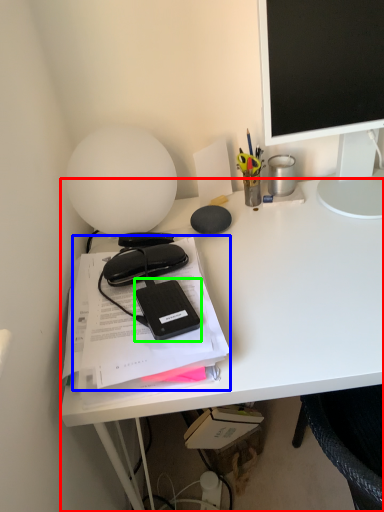
Question: Considering the real-world distances, which object is closest to desk (highlighted by a red box)? document (highlighted by a blue box) or equipment (highlighted by a green box).

Choices:
 (A) document
 (B) equipment

Answer: (A)